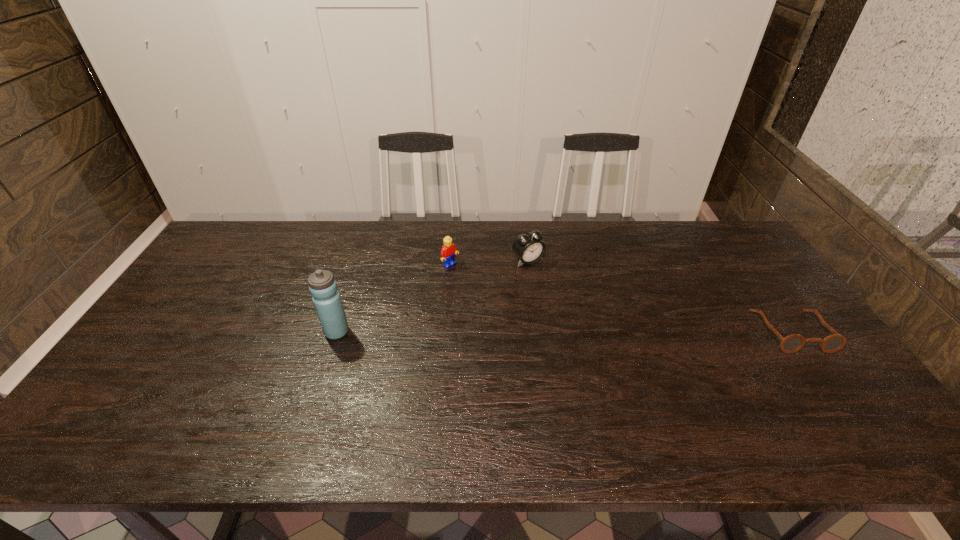
This screenshot has height=540, width=960. I want to click on the tallest object, so click(323, 287).

You are a GUI agent. You are given a task and a screenshot of the screen. Output one action in this format:
    pyautogui.click(x=<x>, y=<y>)
    Task: Click on the leftmost object
    Image resolution: width=960 pixels, height=540 pixels.
    Given the screenshot: What is the action you would take?
    pyautogui.click(x=323, y=287)

This screenshot has width=960, height=540. Identify the location of spectacles. (792, 343).

Locate an element on the screen. Image resolution: width=960 pixels, height=540 pixels. the rightmost object is located at coordinates (x=792, y=343).

This screenshot has width=960, height=540. Identify the location of Lego. (448, 251).

Locate an element on the screen. Image resolution: width=960 pixels, height=540 pixels. alarm clock is located at coordinates (528, 247).

Locate an element on the screen. free space located 0.400m on the right of the tallest object is located at coordinates (492, 332).

Identify the location of free region located 0.160m on the front-facing side of the rightmost object. This screenshot has height=540, width=960. (846, 407).

I want to click on vacant space situated 0.210m on the front-facing side of the Lego, so click(x=499, y=303).

Locate an element on the screen. This screenshot has height=540, width=960. free space located 0.230m on the front-facing side of the Lego is located at coordinates (504, 307).